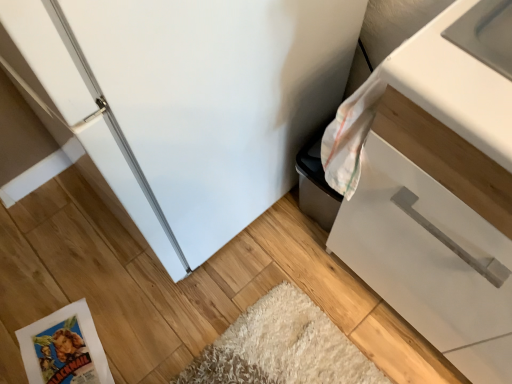
This screenshot has width=512, height=384. In order to click on vacant region below white paper comic book at lower left (from a real-world perspective) in this screenshot , I will do `click(65, 354)`.